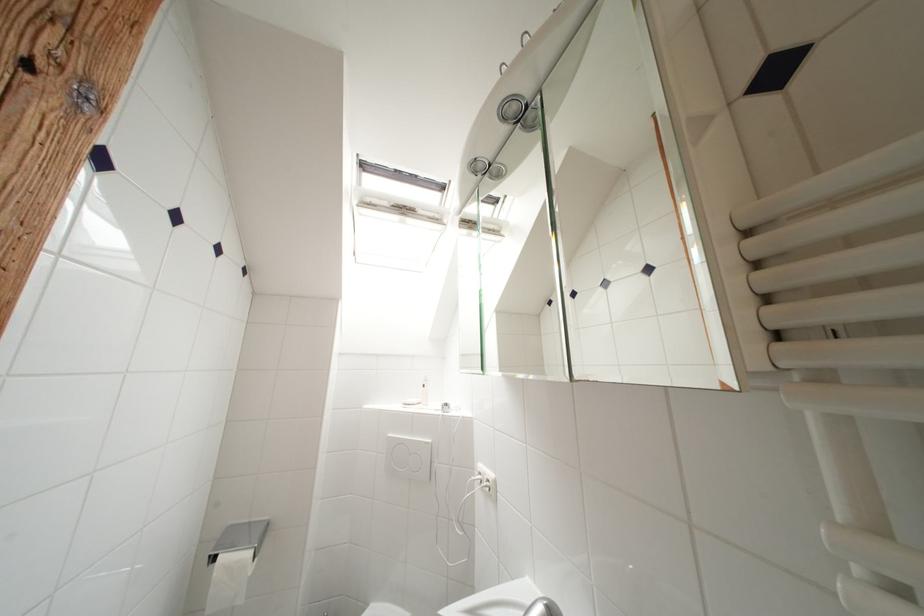
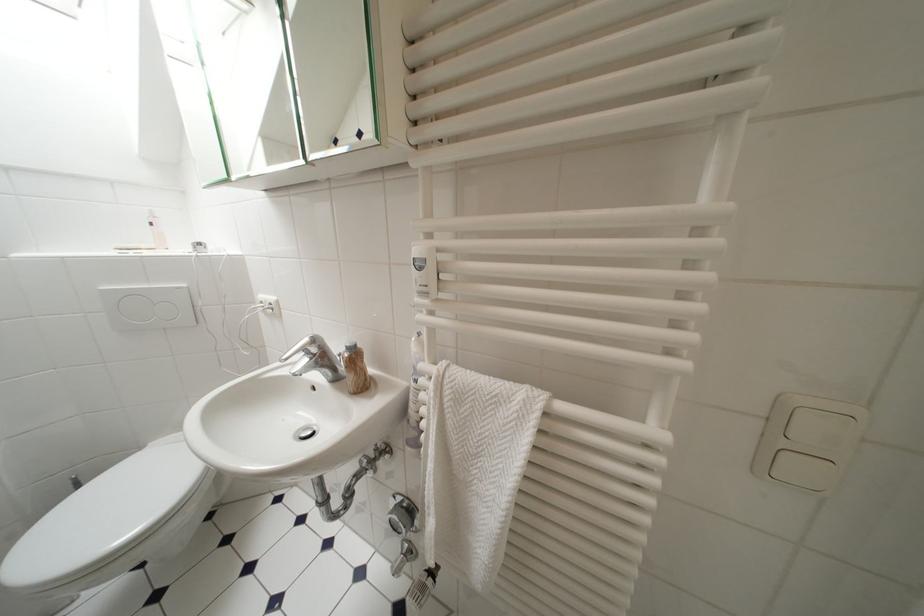
Find the pixel in the second image that matches the point at 432,446 in the first image.

(185, 291)